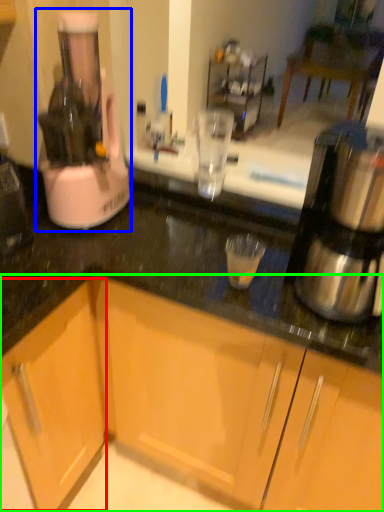
Question: Which is nearer to the cabinetry (highlighted by a red box)? home appliance (highlighted by a blue box) or cabinetry (highlighted by a green box).

Choices:
 (A) home appliance
 (B) cabinetry

Answer: (B)